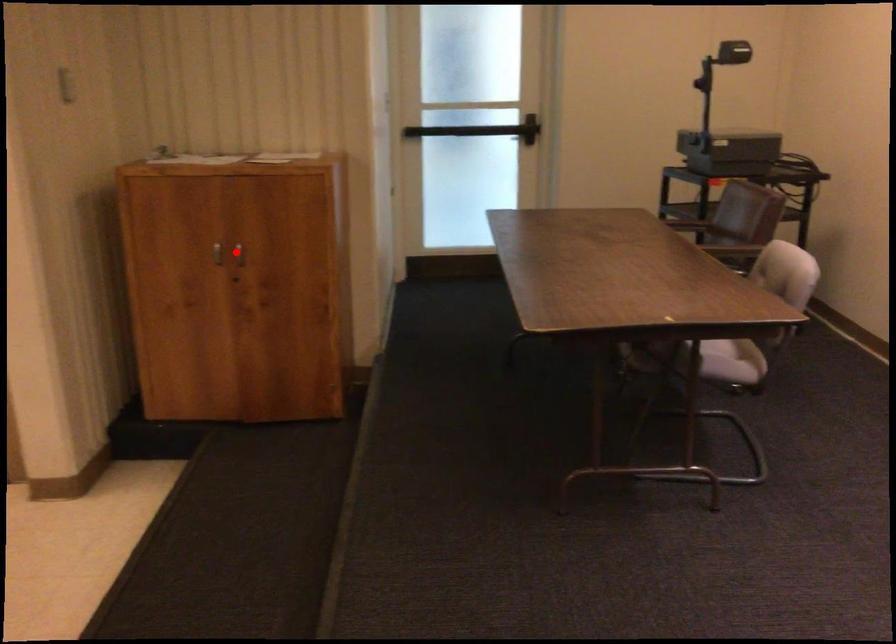
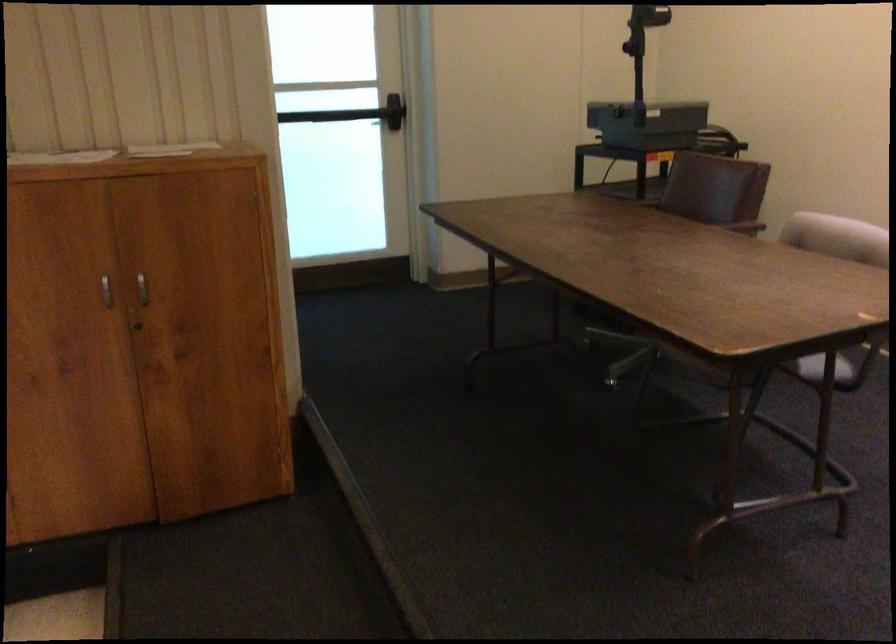
Question: I am providing you with two images of the same scene from different viewpoints. In image1, a red point is highlighted. Considering the same 3D point in image2, which of the following is correct?

Choices:
 (A) It is closer
 (B) It is farther

Answer: (A)